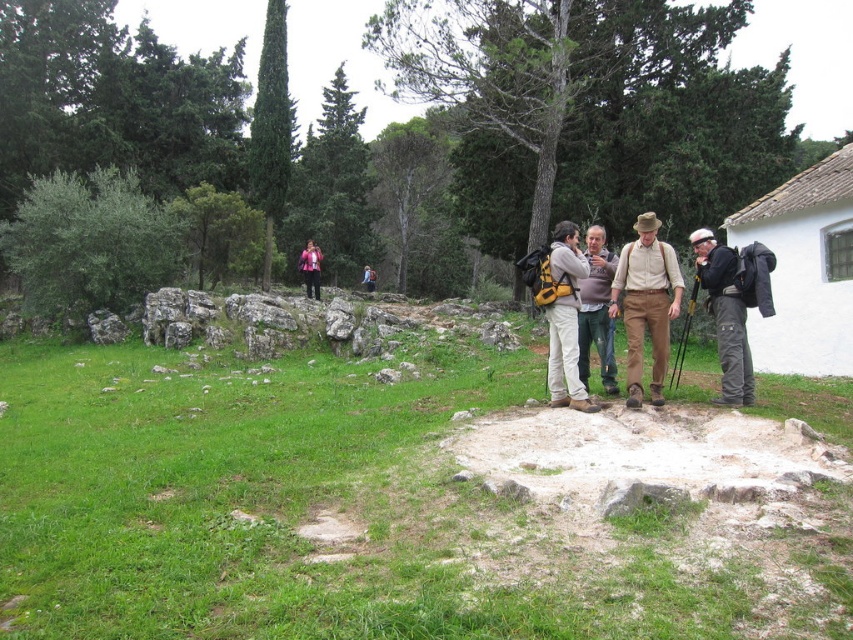
Who is higher up, black backpack at right or knitted sweater at center?

Positioned higher is knitted sweater at center.

Between black backpack at right and knitted sweater at center, which one appears on the right side from the viewer's perspective?

Positioned to the right is black backpack at right.

What do you see at coordinates (724, 316) in the screenshot? This screenshot has width=853, height=640. I see `black backpack at right` at bounding box center [724, 316].

Where is `black backpack at right`? The width and height of the screenshot is (853, 640). black backpack at right is located at coordinates (724, 316).

Can you confirm if khaki cotton pants at center is taller than black backpack at right?

Yes, khaki cotton pants at center is taller than black backpack at right.

In the scene shown: Does khaki cotton pants at center appear on the left side of black backpack at right?

Yes, khaki cotton pants at center is to the left of black backpack at right.

Locate an element on the screen. khaki cotton pants at center is located at coordinates pos(646,305).

Find the location of a particular element. khaki cotton pants at center is located at coordinates (646, 305).

Who is positioned more to the left, knitted sweater at center or light pink fabric at center?

From the viewer's perspective, light pink fabric at center appears more on the left side.

Which is more to the right, knitted sweater at center or light pink fabric at center?

knitted sweater at center is more to the right.

The image size is (853, 640). Find the location of `knitted sweater at center`. knitted sweater at center is located at coordinates (596, 310).